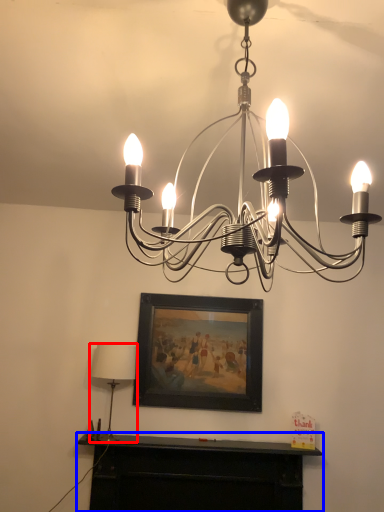
Question: Which of the following is the farthest to the observer, lamp (highlighted by a red box) or furniture (highlighted by a blue box)?

Choices:
 (A) lamp
 (B) furniture

Answer: (B)